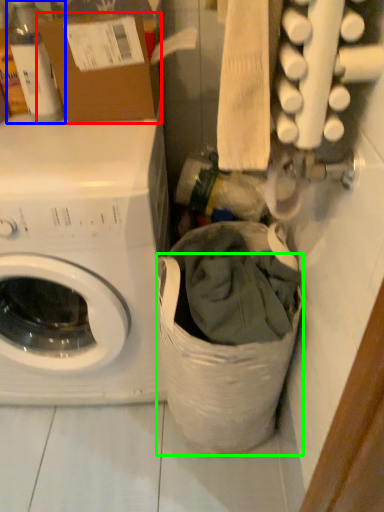
Question: Based on their relative distances, which object is nearer to cardboard box (highlighted by a red box)? Choose from bottle (highlighted by a blue box) and laundry basket (highlighted by a green box).

Choices:
 (A) bottle
 (B) laundry basket

Answer: (A)